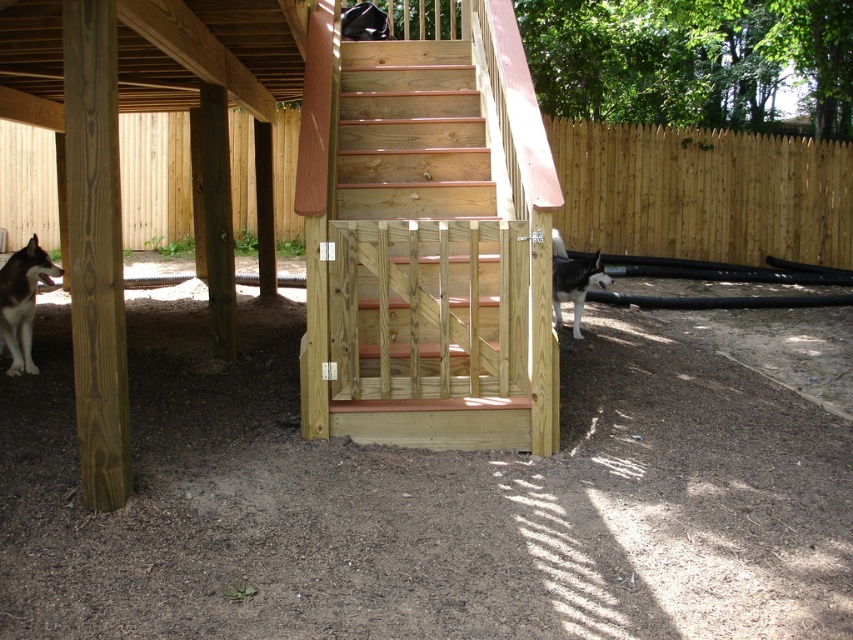
You are a child trying to climb the natural wood stairs at center. There is a white fur dog at right nearby. Which object is closer to you as you start climbing?

The natural wood stairs at center is closer to the viewer than the white fur dog at right, so the stairs are closer to you as you start climbing.

You are a contractor assessing the backyard structure. You need to determine if the white fur dog at right can comfortably pass through the space between the natural wood stairs at center and the wooden gate on the right. Based on their widths, can the dog fit through the space?

The natural wood stairs at center is wider than the white fur dog at right, so the dog can fit through the space between them.